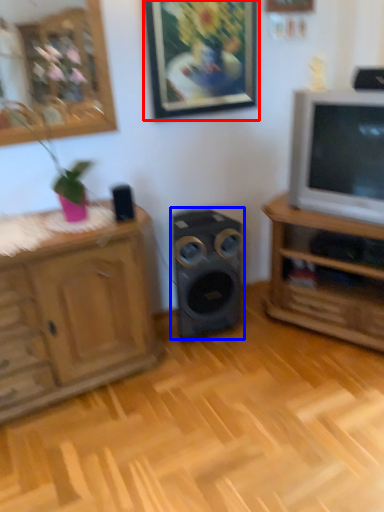
Question: Among these objects, which one is nearest to the camera, picture frame (highlighted by a red box) or speaker (highlighted by a blue box)?

Choices:
 (A) picture frame
 (B) speaker

Answer: (A)